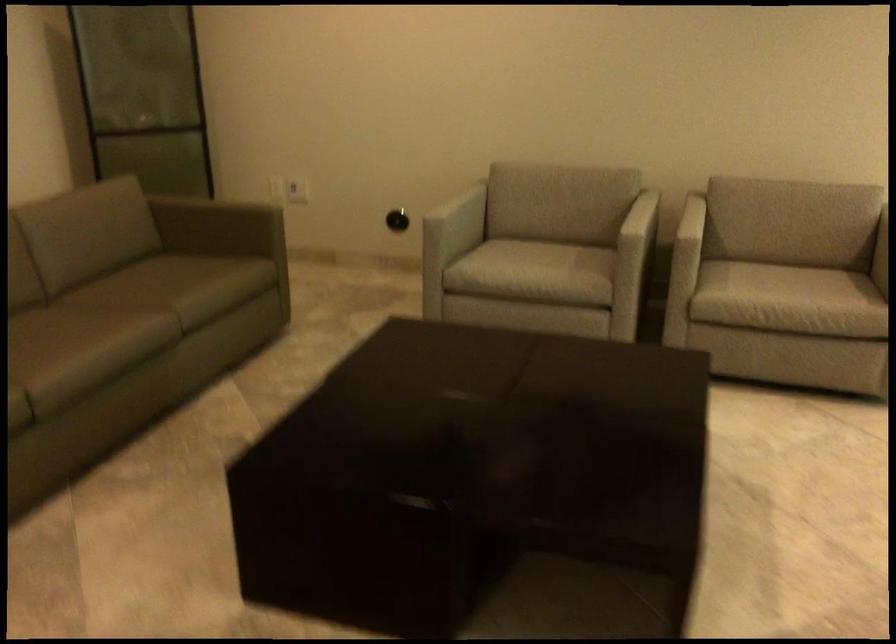
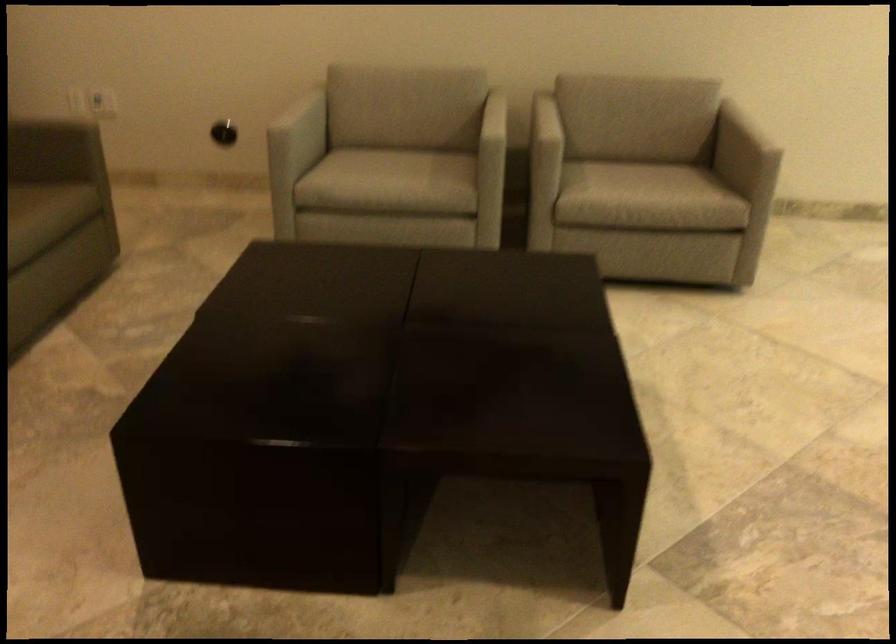
Locate, in the second image, the point that corresponds to pixel 679 239 in the first image.

(545, 140)